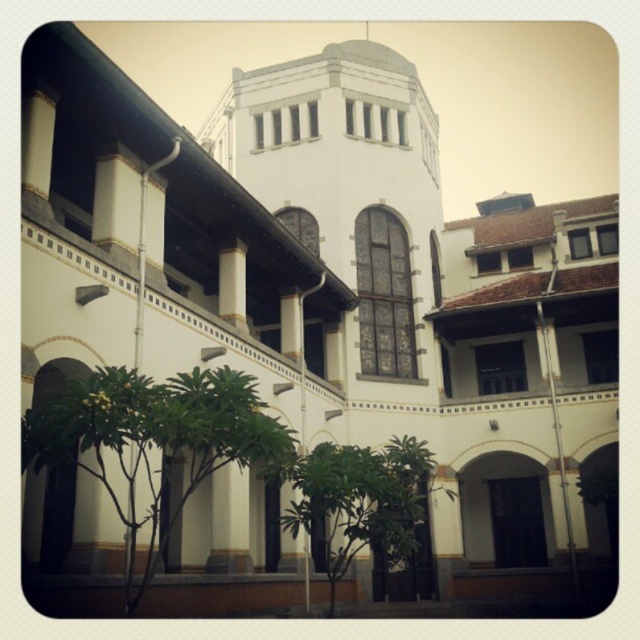
Consider the image. Can you confirm if green leafy tree at lower left is taller than green leafy tree at center?

Incorrect, green leafy tree at lower left's height is not larger of green leafy tree at center's.

Is point (244, 458) more distant than point (333, 580)?

No, it is in front of (333, 580).

Between point (161, 481) and point (387, 460), which one is positioned behind?

Point (387, 460)

Where is `green leafy tree at lower left`? The height and width of the screenshot is (640, 640). green leafy tree at lower left is located at coordinates (154, 440).